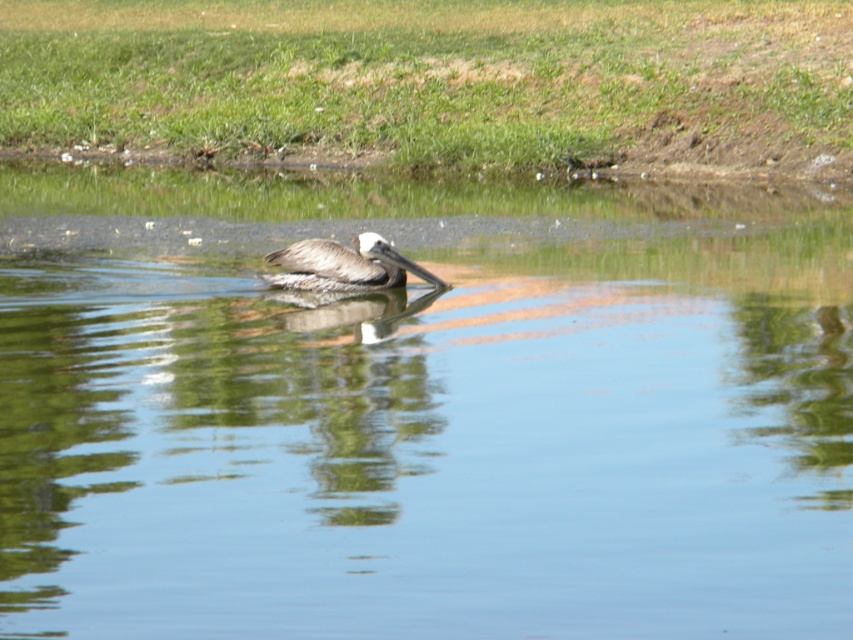
Question: Among these points, which one is nearest to the camera?

Choices:
 (A) (705, 451)
 (B) (355, 288)

Answer: (A)

Question: Which point is closer to the camera taking this photo?

Choices:
 (A) (662, 545)
 (B) (395, 284)

Answer: (A)

Question: From the image, what is the correct spatial relationship of clear water at center in relation to brown feathered pelican at center?

Choices:
 (A) above
 (B) below

Answer: (A)

Question: Can you confirm if clear water at center is positioned to the right of brown feathered pelican at center?

Choices:
 (A) no
 (B) yes

Answer: (A)

Question: Can you confirm if clear water at center is positioned to the right of brown feathered pelican at center?

Choices:
 (A) no
 (B) yes

Answer: (A)